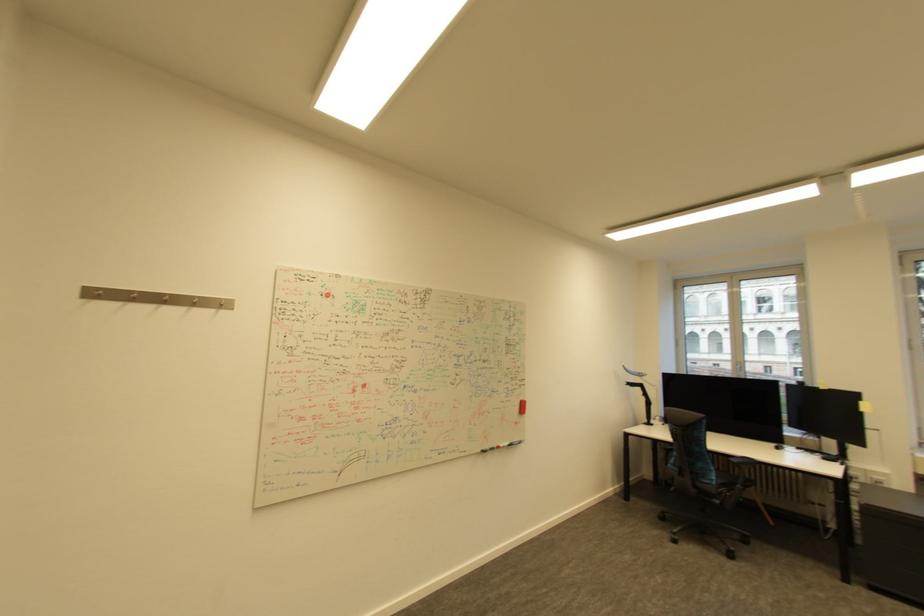
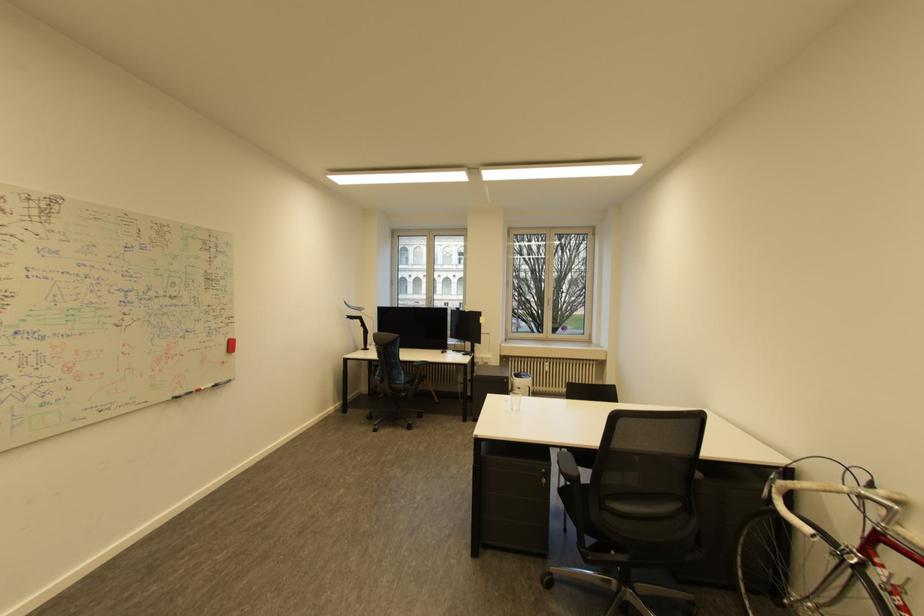
The point at (x=487, y=451) is marked in the first image. Where is the corresponding point in the second image?

(176, 399)